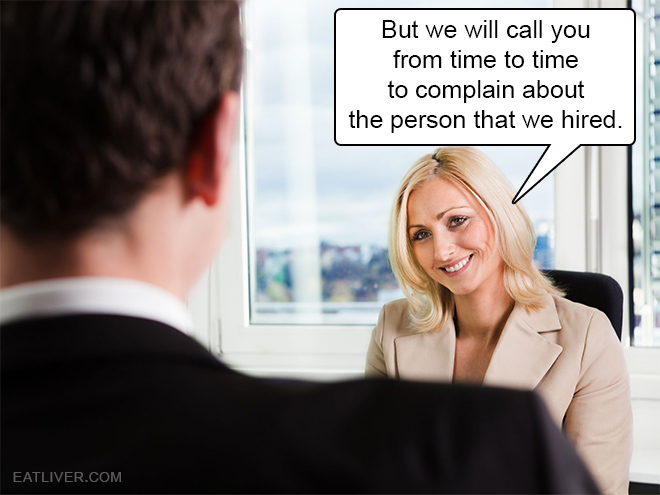
At what (x,y) coordinates should I click in order to perform the action: click on glass. Please return your answer as a coordinate pair (x, y). Looking at the image, I should click on (331, 182).